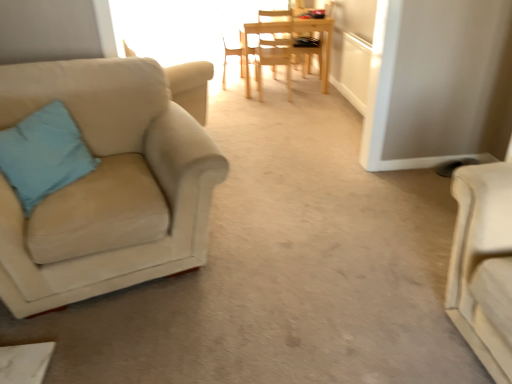
Measure the distance between wooden chair at center, acting as the 4th chair starting from the front, and camera.

4.19 meters.

The width and height of the screenshot is (512, 384). Describe the element at coordinates (307, 49) in the screenshot. I see `light wood chair at center, the third chair in the back-to-front sequence` at that location.

You are a GUI agent. You are given a task and a screenshot of the screen. Output one action in this format:
    pyautogui.click(x=<x>, y=<y>)
    Task: Click on the light wood chair at center, acting as the 3th chair starting from the front
    
    Given the screenshot: What is the action you would take?
    pyautogui.click(x=307, y=49)

Measure the distance between light wood chair at center, the 2th chair in the front-to-back sequence, and camera.

light wood chair at center, the 2th chair in the front-to-back sequence, is 4.06 meters from camera.

In order to face light wood chair at center, which is counted as the fourth chair, starting from the back, should I rotate leftwards or rightwards?

Rotate your view right by about 2.566°.

I want to click on suede beige armchair at left, which ranks as the 5th chair in back-to-front order, so click(106, 185).

Does point (304, 45) appear closer or farther from the camera than point (190, 116)?

Point (304, 45).

Considering the sizes of light wood chair at center, the third chair in the back-to-front sequence, and suede beige armchair at left, which ranks as the 1th chair in front-to-back order, in the image, is light wood chair at center, the third chair in the back-to-front sequence, wider or thinner than suede beige armchair at left, which ranks as the 1th chair in front-to-back order,?

light wood chair at center, the third chair in the back-to-front sequence, is thinner than suede beige armchair at left, which ranks as the 1th chair in front-to-back order.

Does light wood chair at center, acting as the 3th chair starting from the front, have a lesser height compared to suede beige armchair at left, which ranks as the 1th chair in front-to-back order?

Yes, light wood chair at center, acting as the 3th chair starting from the front, is shorter than suede beige armchair at left, which ranks as the 1th chair in front-to-back order.

From a real-world perspective, is light wood chair at center, acting as the 3th chair starting from the front, positioned above or below suede beige armchair at left, which ranks as the 5th chair in back-to-front order?

Clearly, from a real-world perspective, light wood chair at center, acting as the 3th chair starting from the front, is below suede beige armchair at left, which ranks as the 5th chair in back-to-front order.

Looking at this image, can you confirm if suede beige armchair at left, which ranks as the 1th chair in front-to-back order, is smaller than wooden chair at center, the 1th chair in the back-to-front sequence?

No.

Is wooden chair at center, the 5th chair viewed from the front, surrounded by suede beige armchair at left, which ranks as the 5th chair in back-to-front order?

No, suede beige armchair at left, which ranks as the 5th chair in back-to-front order, does not contain wooden chair at center, the 5th chair viewed from the front.

Considering the sizes of suede beige armchair at left, which ranks as the 1th chair in front-to-back order, and wooden chair at center, the 5th chair viewed from the front, in the image, is suede beige armchair at left, which ranks as the 1th chair in front-to-back order, wider or thinner than wooden chair at center, the 5th chair viewed from the front,?

Considering their sizes, suede beige armchair at left, which ranks as the 1th chair in front-to-back order, looks broader than wooden chair at center, the 5th chair viewed from the front.

Is suede beige armchair at left, which ranks as the 5th chair in back-to-front order, far from wooden chair at center, the 1th chair in the back-to-front sequence?

Yes, suede beige armchair at left, which ranks as the 5th chair in back-to-front order, and wooden chair at center, the 1th chair in the back-to-front sequence, are located far from each other.

Is light wood chair at center, the 2th chair in the front-to-back sequence, wider or thinner than wooden chair at center, the 5th chair viewed from the front?

light wood chair at center, the 2th chair in the front-to-back sequence, is wider than wooden chair at center, the 5th chair viewed from the front.

Is light wood chair at center, the 2th chair in the front-to-back sequence, to the right of wooden chair at center, the 5th chair viewed from the front, from the viewer's perspective?

Incorrect, light wood chair at center, the 2th chair in the front-to-back sequence, is not on the right side of wooden chair at center, the 5th chair viewed from the front.

Is light wood chair at center, the 2th chair in the front-to-back sequence, facing towards wooden chair at center, the 1th chair in the back-to-front sequence?

No, light wood chair at center, the 2th chair in the front-to-back sequence, does not turn towards wooden chair at center, the 1th chair in the back-to-front sequence.

Is wooden chair at center, the 5th chair viewed from the front, oriented towards suede beige armchair at left, which ranks as the 1th chair in front-to-back order?

No, wooden chair at center, the 5th chair viewed from the front, is not oriented towards suede beige armchair at left, which ranks as the 1th chair in front-to-back order.

From a real-world perspective, which object stands above the other?

suede beige armchair at left, which ranks as the 5th chair in back-to-front order.

Can you confirm if wooden chair at center, the 1th chair in the back-to-front sequence, is taller than suede beige armchair at left, which ranks as the 1th chair in front-to-back order?

Yes, wooden chair at center, the 1th chair in the back-to-front sequence, is taller than suede beige armchair at left, which ranks as the 1th chair in front-to-back order.

How distant is wooden chair at center, the 5th chair viewed from the front, from suede beige armchair at left, which ranks as the 1th chair in front-to-back order?

wooden chair at center, the 5th chair viewed from the front, and suede beige armchair at left, which ranks as the 1th chair in front-to-back order, are 9.58 feet apart from each other.

From the image's perspective, does suede beige armchair at left, which ranks as the 1th chair in front-to-back order, appear lower than wooden chair at center, which is the second chair in back-to-front order?

Yes, from the image's perspective, suede beige armchair at left, which ranks as the 1th chair in front-to-back order, is beneath wooden chair at center, which is the second chair in back-to-front order.

Would you say suede beige armchair at left, which ranks as the 5th chair in back-to-front order, is to the left or to the right of wooden chair at center, acting as the 4th chair starting from the front, in the picture?

suede beige armchair at left, which ranks as the 5th chair in back-to-front order, is positioned on wooden chair at center, acting as the 4th chair starting from the front,'s left side.

How different are the orientations of suede beige armchair at left, which ranks as the 1th chair in front-to-back order, and wooden chair at center, acting as the 4th chair starting from the front, in degrees?

The angular difference between suede beige armchair at left, which ranks as the 1th chair in front-to-back order, and wooden chair at center, acting as the 4th chair starting from the front, is 71.6 degrees.

Can you confirm if light wood chair at center, acting as the 3th chair starting from the front, is positioned to the left of blue fabric pillow at left?

No, light wood chair at center, acting as the 3th chair starting from the front, is not to the left of blue fabric pillow at left.

Considering the positions of point (308, 64) and point (77, 162), is point (308, 64) closer or farther from the camera than point (77, 162)?

Point (308, 64) appears to be farther away from the viewer than point (77, 162).

From a real-world perspective, between light wood chair at center, the third chair in the back-to-front sequence, and blue fabric pillow at left, who is vertically higher?

From a 3D spatial view, blue fabric pillow at left is above.

Is light wood chair at center, the third chair in the back-to-front sequence, outside of blue fabric pillow at left?

Yes.

What's the angular difference between wooden chair at center, acting as the 4th chair starting from the front, and suede beige armchair at left, which ranks as the 1th chair in front-to-back order,'s facing directions?

The angle between the facing direction of wooden chair at center, acting as the 4th chair starting from the front, and the facing direction of suede beige armchair at left, which ranks as the 1th chair in front-to-back order, is 71.6 degrees.

Which is in front, point (224, 58) or point (76, 95)?

The point (76, 95) is closer.

From a real-world perspective, is wooden chair at center, which is the second chair in back-to-front order, below suede beige armchair at left, which ranks as the 1th chair in front-to-back order?

Yes, from a real-world perspective, wooden chair at center, which is the second chair in back-to-front order, is below suede beige armchair at left, which ranks as the 1th chair in front-to-back order.

You are a GUI agent. You are given a task and a screenshot of the screen. Output one action in this format:
    pyautogui.click(x=<x>, y=<y>)
    Task: Click on the chair that is the 2nd one when counting upward from the suede beige armchair at left, which ranks as the 5th chair in back-to-front order (from the image's perspective)
    This screenshot has width=512, height=384.
    Given the screenshot: What is the action you would take?
    point(307,49)

You are a GUI agent. You are given a task and a screenshot of the screen. Output one action in this format:
    pyautogui.click(x=<x>, y=<y>)
    Task: Click on the 4th chair below the wooden chair at center, the 5th chair viewed from the front (from the image's perspective)
    The height and width of the screenshot is (384, 512).
    Given the screenshot: What is the action you would take?
    pyautogui.click(x=106, y=185)

From the image, which object appears to be nearer to wooden chair at center, which is the second chair in back-to-front order, light wood chair at center, acting as the 3th chair starting from the front, or blue fabric pillow at left?

Among the two, light wood chair at center, acting as the 3th chair starting from the front, is located nearer to wooden chair at center, which is the second chair in back-to-front order.

Consider the image. When comparing their distances from suede beige armchair at left, which ranks as the 1th chair in front-to-back order, does wooden chair at center, the 5th chair viewed from the front, or light wood chair at center, which is counted as the fourth chair, starting from the back, seem closer?

light wood chair at center, which is counted as the fourth chair, starting from the back.

Which object lies nearer to the anchor point suede beige armchair at left, which ranks as the 5th chair in back-to-front order, light wood chair at center, the third chair in the back-to-front sequence, or light wood chair at center, the 2th chair in the front-to-back sequence?

Based on the image, light wood chair at center, the 2th chair in the front-to-back sequence, appears to be nearer to suede beige armchair at left, which ranks as the 5th chair in back-to-front order.

Considering their positions, is light wood chair at center, which is counted as the fourth chair, starting from the back, positioned further to blue fabric pillow at left than suede beige armchair at left, which ranks as the 5th chair in back-to-front order?

light wood chair at center, which is counted as the fourth chair, starting from the back.

Estimate the real-world distances between objects in this image. Which object is closer to blue fabric pillow at left, light wood chair at center, the 2th chair in the front-to-back sequence, or light wood chair at center, acting as the 3th chair starting from the front?

Among the two, light wood chair at center, the 2th chair in the front-to-back sequence, is located nearer to blue fabric pillow at left.

Estimate the real-world distances between objects in this image. Which object is further from light wood chair at center, acting as the 3th chair starting from the front, suede beige armchair at left, which ranks as the 1th chair in front-to-back order, or wooden chair at center, the 1th chair in the back-to-front sequence?

Based on the image, suede beige armchair at left, which ranks as the 1th chair in front-to-back order, appears to be further to light wood chair at center, acting as the 3th chair starting from the front.

Based on their spatial positions, is blue fabric pillow at left or light wood chair at center, the 2th chair in the front-to-back sequence, further from suede beige armchair at left, which ranks as the 1th chair in front-to-back order?

Among the two, light wood chair at center, the 2th chair in the front-to-back sequence, is located further to suede beige armchair at left, which ranks as the 1th chair in front-to-back order.

Consider the image. Based on their spatial positions, is light wood chair at center, the 2th chair in the front-to-back sequence, or wooden chair at center, the 1th chair in the back-to-front sequence, further from light wood chair at center, the third chair in the back-to-front sequence?

light wood chair at center, the 2th chair in the front-to-back sequence.

The width and height of the screenshot is (512, 384). In order to click on pillow between suede beige armchair at left, which ranks as the 5th chair in back-to-front order, and wooden chair at center, which is the second chair in back-to-front order, along the z-axis in this screenshot , I will do `click(44, 154)`.

This screenshot has height=384, width=512. What are the coordinates of `chair between blue fabric pillow at left and light wood chair at center, the third chair in the back-to-front sequence, from front to back` in the screenshot? It's located at (269, 52).

Locate an element on the screen. pillow positioned between suede beige armchair at left, which ranks as the 1th chair in front-to-back order, and wooden chair at center, the 1th chair in the back-to-front sequence, from near to far is located at coordinates (44, 154).

The image size is (512, 384). I want to click on chair between wooden chair at center, which is the second chair in back-to-front order, and light wood chair at center, acting as the 3th chair starting from the front, in the horizontal direction, so click(269, 52).